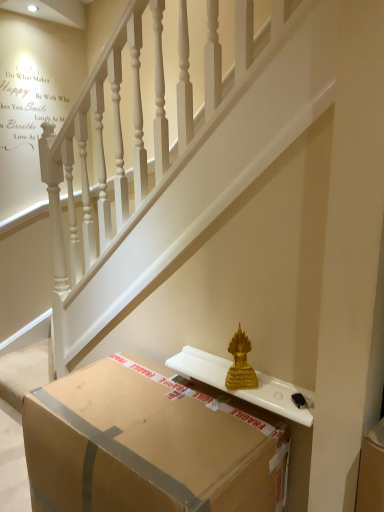
Question: Considering the relative sizes of brown cardboard box at lower center and gold statue at center in the image provided, is brown cardboard box at lower center smaller than gold statue at center?

Choices:
 (A) no
 (B) yes

Answer: (A)

Question: Considering the relative sizes of brown cardboard box at lower center and gold statue at center in the image provided, is brown cardboard box at lower center thinner than gold statue at center?

Choices:
 (A) no
 (B) yes

Answer: (A)

Question: Is gold statue at center a part of brown cardboard box at lower center?

Choices:
 (A) yes
 (B) no

Answer: (B)

Question: From a real-world perspective, is brown cardboard box at lower center physically below gold statue at center?

Choices:
 (A) yes
 (B) no

Answer: (A)

Question: Considering the relative positions of brown cardboard box at lower center and gold statue at center in the image provided, is brown cardboard box at lower center to the left of gold statue at center from the viewer's perspective?

Choices:
 (A) no
 (B) yes

Answer: (B)

Question: From the image's perspective, would you say brown cardboard box at lower center is positioned over gold statue at center?

Choices:
 (A) no
 (B) yes

Answer: (A)

Question: Is gold statue at center positioned before brown cardboard box at lower center?

Choices:
 (A) yes
 (B) no

Answer: (B)

Question: From the image's perspective, is gold statue at center below brown cardboard box at lower center?

Choices:
 (A) no
 (B) yes

Answer: (A)

Question: Considering the relative sizes of gold statue at center and brown cardboard box at lower center in the image provided, is gold statue at center smaller than brown cardboard box at lower center?

Choices:
 (A) no
 (B) yes

Answer: (B)

Question: Could you tell me if gold statue at center is turned towards brown cardboard box at lower center?

Choices:
 (A) yes
 (B) no

Answer: (A)

Question: Does gold statue at center have a greater height compared to brown cardboard box at lower center?

Choices:
 (A) yes
 (B) no

Answer: (A)

Question: Can you confirm if gold statue at center is positioned to the right of brown cardboard box at lower center?

Choices:
 (A) yes
 (B) no

Answer: (A)

Question: Based on their sizes in the image, would you say gold statue at center is bigger or smaller than brown cardboard box at lower center?

Choices:
 (A) small
 (B) big

Answer: (A)